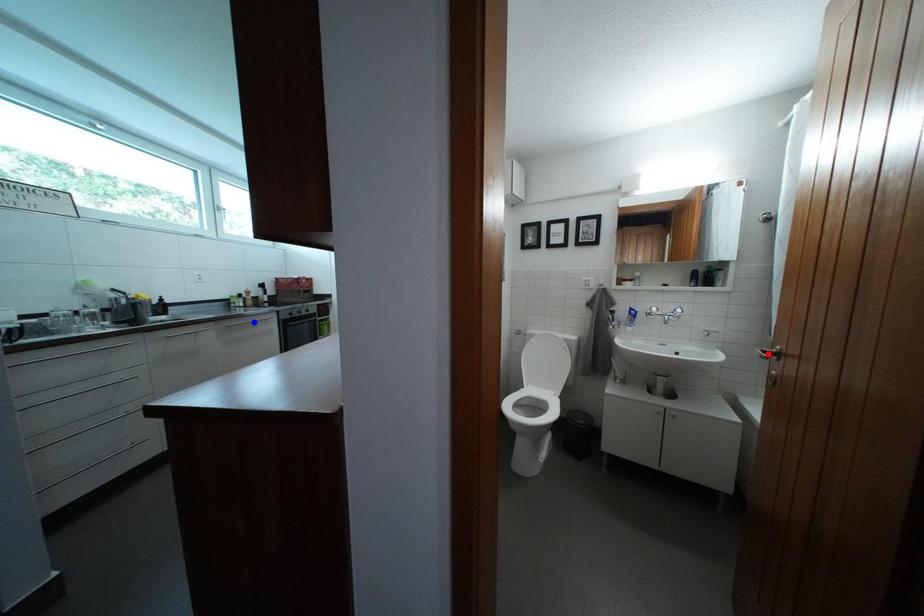
Question: Which of the two points in the image is closer to the camera?

Choices:
 (A) Blue point is closer.
 (B) Red point is closer.

Answer: (B)